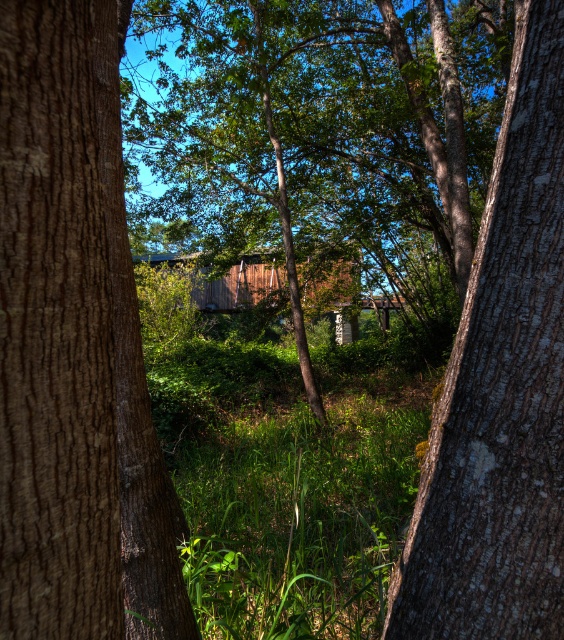
Does brown rough bark tree trunk at left appear on the right side of smooth bark tree trunk at center?

No, brown rough bark tree trunk at left is not to the right of smooth bark tree trunk at center.

This screenshot has width=564, height=640. Find the location of `brown rough bark tree trunk at left`. brown rough bark tree trunk at left is located at coordinates (73, 348).

Which is in front, point (63, 592) or point (494, 177)?

Point (63, 592)

Locate an element on the screen. brown rough bark tree trunk at left is located at coordinates (73, 348).